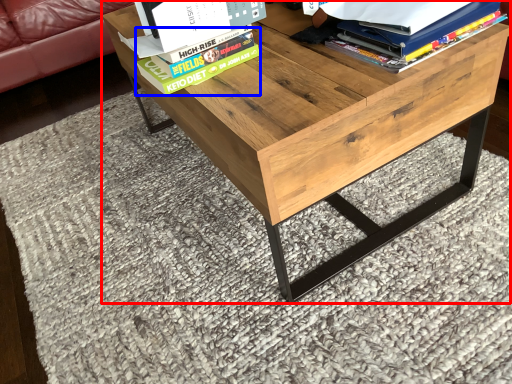
Question: Among these objects, which one is farthest to the camera, table (highlighted by a red box) or paperback book (highlighted by a blue box)?

Choices:
 (A) table
 (B) paperback book

Answer: (B)